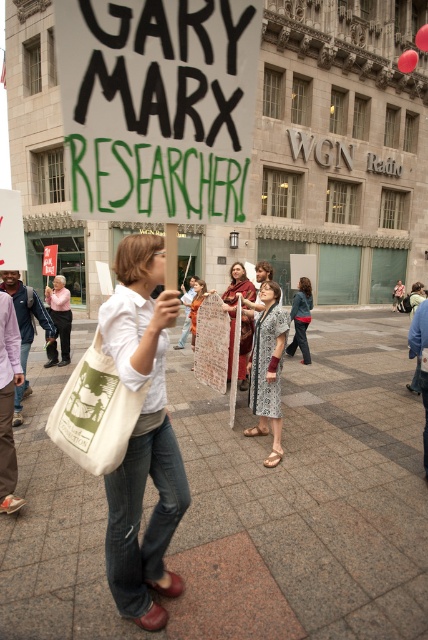
Question: Which object is closer to the camera taking this photo?

Choices:
 (A) patterned fabric dress at center
 (B) matte pink shirt at center

Answer: (A)

Question: Can you confirm if matte red scarf at center is thinner than denim jacket at center?

Choices:
 (A) no
 (B) yes

Answer: (B)

Question: Estimate the real-world distances between objects in this image. Which object is closer to the matte white shirt at center?

Choices:
 (A) matte pink shirt at center
 (B) denim jacket at center

Answer: (B)

Question: Where is matte pink shirt at center located in relation to denim jacket at center in the image?

Choices:
 (A) left
 (B) right

Answer: (A)

Question: Which is farther from the matte red scarf at center?

Choices:
 (A) matte pink shirt at center
 (B) matte white shirt at center
 (C) denim jacket at center

Answer: (A)

Question: Is the position of matte red scarf at center more distant than that of matte pink shirt at center?

Choices:
 (A) yes
 (B) no

Answer: (B)